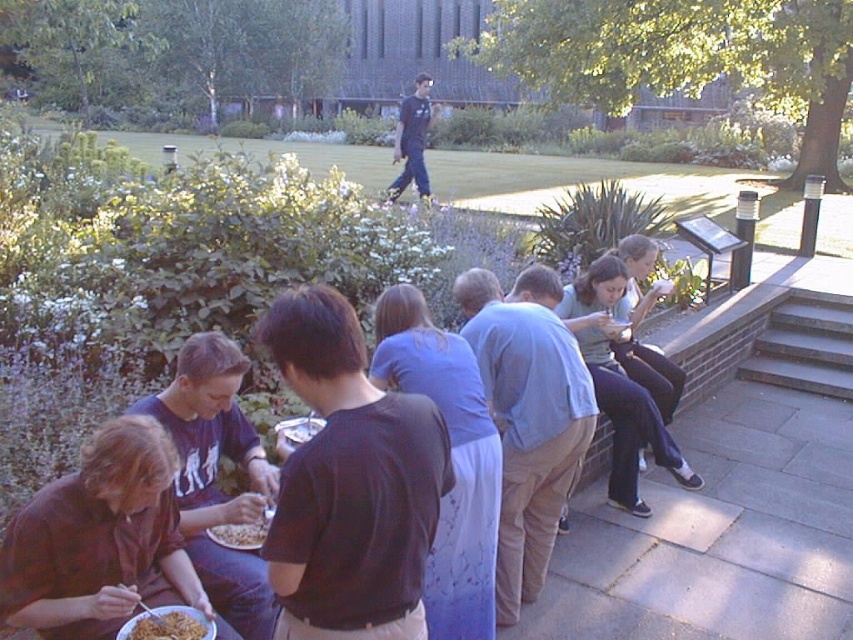
Can you confirm if brown fabric shirt at lower left is smaller than smooth white noodles at lower left?

Incorrect, brown fabric shirt at lower left is not smaller in size than smooth white noodles at lower left.

Can you confirm if brown fabric shirt at lower left is wider than smooth white noodles at lower left?

Yes.

Is point (38, 620) positioned in front of point (252, 541)?

Yes, point (38, 620) is in front of point (252, 541).

Identify the location of brown fabric shirt at lower left. (99, 540).

Where is `brown fabric shirt at lower left`? This screenshot has width=853, height=640. brown fabric shirt at lower left is located at coordinates (99, 540).

Is brown fabric shirt at lower left in front of golden crispy noodles at lower left?

Yes, brown fabric shirt at lower left is in front of golden crispy noodles at lower left.

Identify the location of brown fabric shirt at lower left. (99, 540).

Where is `brown fabric shirt at lower left`? This screenshot has height=640, width=853. brown fabric shirt at lower left is located at coordinates (99, 540).

Is point (200, 621) farther from camera compared to point (244, 525)?

That is False.

Who is more forward, (x=132, y=620) or (x=248, y=522)?

Positioned in front is point (x=132, y=620).

Find the location of a particular element. golden crispy noodles at lower left is located at coordinates (165, 625).